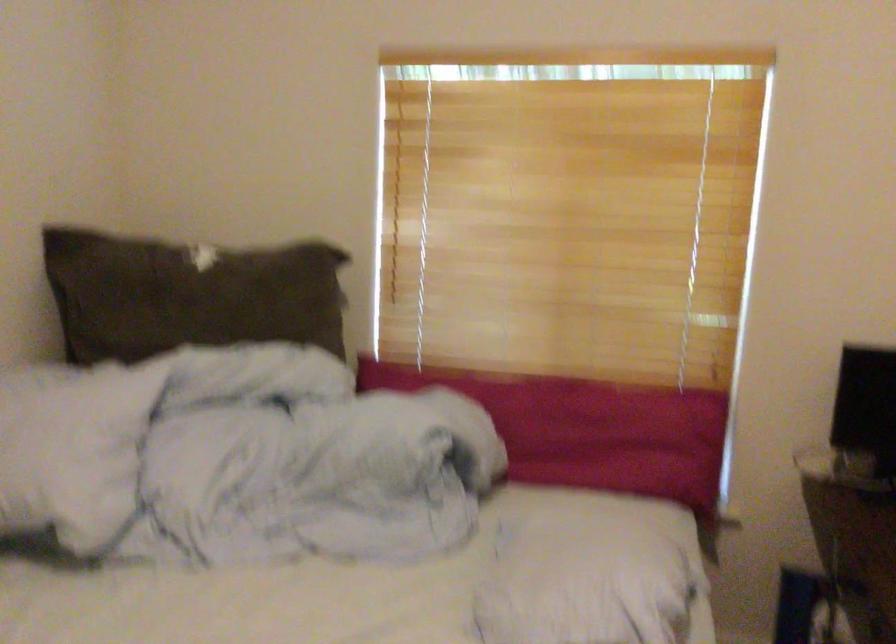
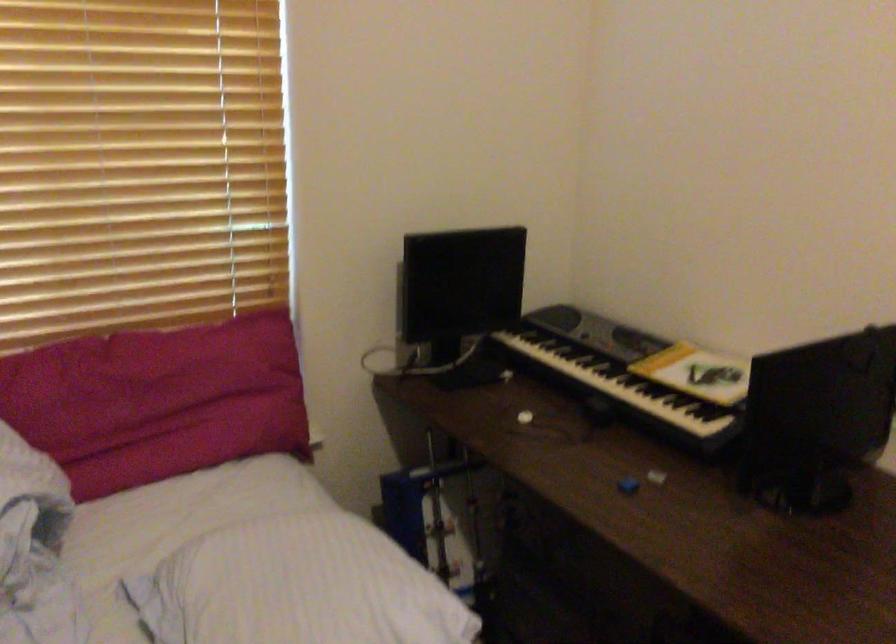
Where in the second image is the point corresponding to (x=599, y=433) from the first image?

(159, 401)